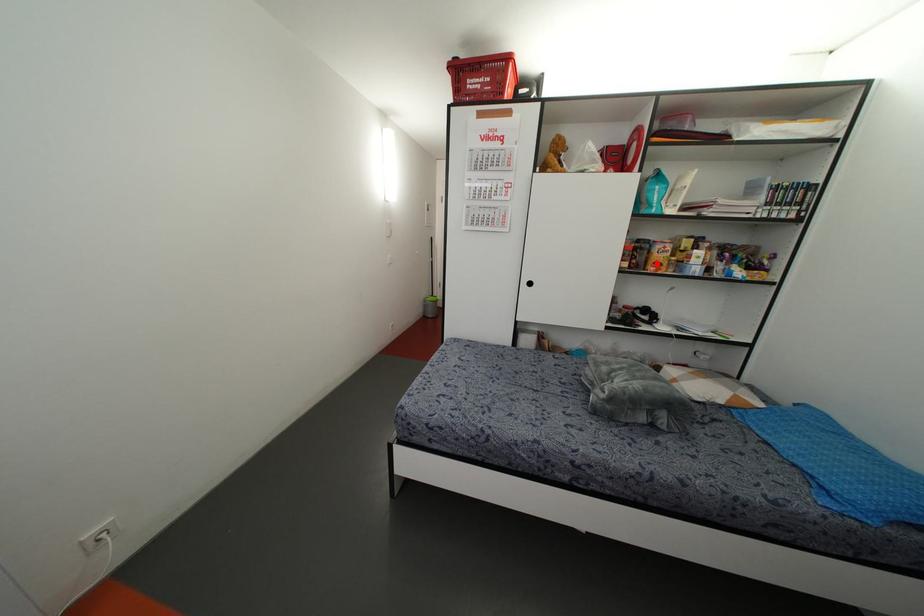
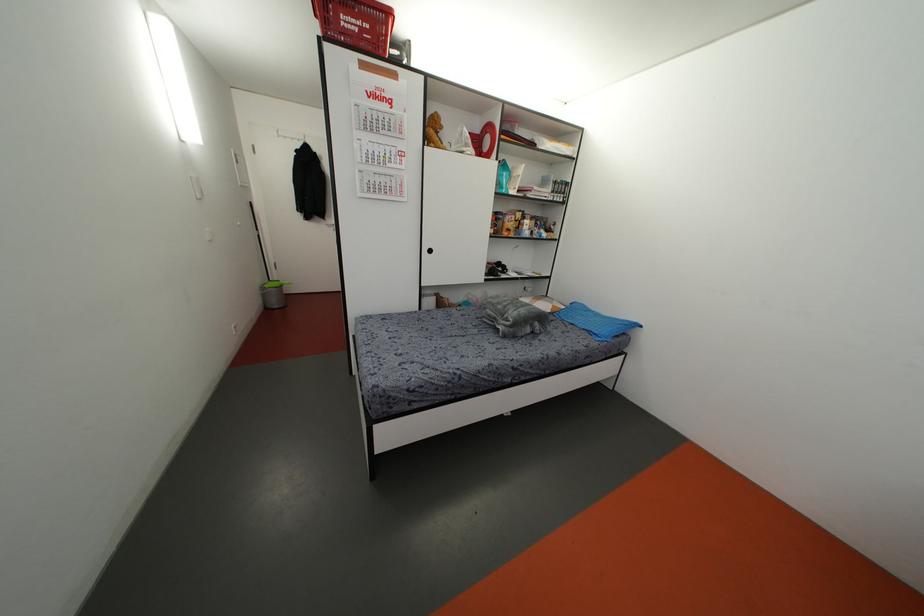
Where in the second image is the point corresponding to the highlighted location from the first image?

(507, 229)